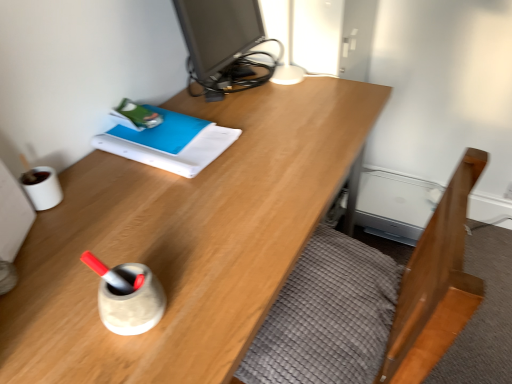
At what (x,y) coordinates should I click in order to perform the action: click on vacant area on top of wooden bed frame at lower right (from a real-world perspective). Please return your answer as a coordinate pair (x, y). Looking at the image, I should click on (321, 301).